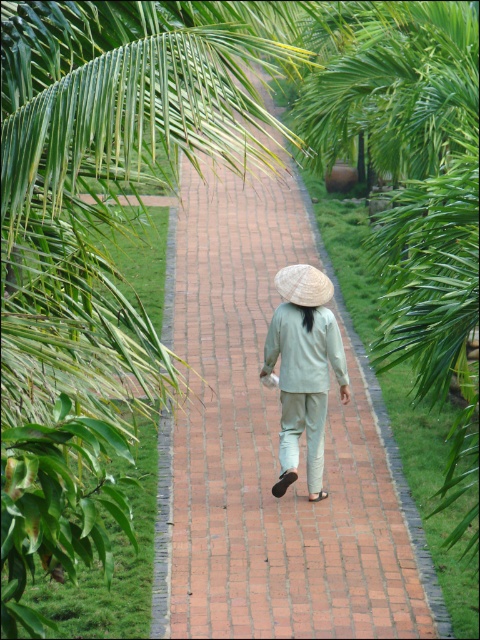
From the picture: Is brick pavement at center closer to camera compared to white straw hat at center?

Yes, it is in front of white straw hat at center.

Does brick pavement at center have a lesser width compared to white straw hat at center?

No, brick pavement at center is not thinner than white straw hat at center.

Which is behind, point (291, 193) or point (305, 278)?

Point (291, 193)

The image size is (480, 640). Find the location of `brick pavement at center`. brick pavement at center is located at coordinates (271, 449).

Can you confirm if light green fabric at center is taller than white straw hat at center?

Yes.

Does point (334, 371) come closer to viewer compared to point (279, 280)?

No, it is not.

You are a GUI agent. You are given a task and a screenshot of the screen. Output one action in this format:
    pyautogui.click(x=<x>, y=<y>)
    Task: Click on the light green fabric at center
    This screenshot has width=480, height=640.
    Given the screenshot: What is the action you would take?
    pyautogui.click(x=303, y=369)

Who is more forward, (182, 248) or (283, 330)?

Point (283, 330) is more forward.

Does brick pavement at center appear under light green fabric at center?

No, brick pavement at center is not below light green fabric at center.

Is point (313, 618) positioned behind point (276, 321)?

No, it is not.

This screenshot has height=640, width=480. Find the location of `brick pavement at center`. brick pavement at center is located at coordinates (271, 449).